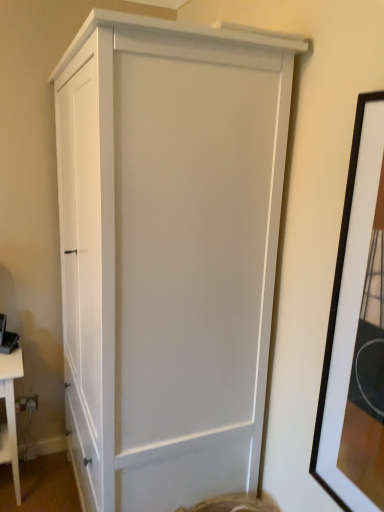
The width and height of the screenshot is (384, 512). What do you see at coordinates (10, 414) in the screenshot? I see `white matte table at lower left` at bounding box center [10, 414].

Locate an element on the screen. white matte cabinet at center is located at coordinates (168, 252).

Where is `black matte picture frame at right`? black matte picture frame at right is located at coordinates (356, 331).

Does white matte table at lower left have a smaller size compared to black matte picture frame at right?

Actually, white matte table at lower left might be larger than black matte picture frame at right.

You are a GUI agent. You are given a task and a screenshot of the screen. Output one action in this format:
    pyautogui.click(x=<x>, y=<y>)
    Task: Click on the table on the left of black matte picture frame at right
    
    Given the screenshot: What is the action you would take?
    pyautogui.click(x=10, y=414)

From a real-world perspective, does white matte table at lower left sit lower than black matte picture frame at right?

Yes.

Choose the correct answer: Is white matte table at lower left inside black matte picture frame at right or outside it?

white matte table at lower left lies outside black matte picture frame at right.

Is black matte picture frame at right turned away from white matte cabinet at center?

black matte picture frame at right does not have its back to white matte cabinet at center.

Is black matte picture frame at right next to white matte cabinet at center?

No, black matte picture frame at right is not touching white matte cabinet at center.

Does black matte picture frame at right have a larger size compared to white matte cabinet at center?

No, black matte picture frame at right is not bigger than white matte cabinet at center.

From the image's perspective, is black matte picture frame at right located beneath white matte cabinet at center?

No, from the image's perspective, black matte picture frame at right is not below white matte cabinet at center.

Is white matte cabinet at center bigger than black matte picture frame at right?

Indeed, white matte cabinet at center has a larger size compared to black matte picture frame at right.

Relative to black matte picture frame at right, is white matte cabinet at center in front or behind?

Clearly, white matte cabinet at center is behind black matte picture frame at right.

Is white matte cabinet at center looking in the opposite direction of black matte picture frame at right?

That's not correct — white matte cabinet at center is not looking away from black matte picture frame at right.

Does white matte cabinet at center touch black matte picture frame at right?

white matte cabinet at center and black matte picture frame at right are clearly separated.

Is black matte picture frame at right thinner than white matte table at lower left?

Indeed, black matte picture frame at right has a lesser width compared to white matte table at lower left.

Is black matte picture frame at right taller than white matte table at lower left?

Yes, black matte picture frame at right is taller than white matte table at lower left.

From a real-world perspective, is black matte picture frame at right positioned under white matte table at lower left based on gravity?

Incorrect, from a real-world perspective, black matte picture frame at right is higher than white matte table at lower left.

Is black matte picture frame at right positioned with its back to white matte table at lower left?

No, black matte picture frame at right's orientation is not away from white matte table at lower left.

From the image's perspective, which is above, white matte cabinet at center or white matte table at lower left?

white matte cabinet at center, from the image's perspective.

Is white matte cabinet at center inside or outside of white matte table at lower left?

white matte cabinet at center is located beyond the bounds of white matte table at lower left.

Is white matte cabinet at center in front of or behind white matte table at lower left in the image?

white matte cabinet at center is positioned closer to the viewer than white matte table at lower left.

From the picture: Is white matte cabinet at center taller or shorter than white matte table at lower left?

Considering their sizes, white matte cabinet at center has more height than white matte table at lower left.

Locate an element on the screen. This screenshot has height=512, width=384. cupboard above the white matte table at lower left (from the image's perspective) is located at coordinates (168, 252).

Considering the relative positions of white matte table at lower left and white matte cabinet at center in the image provided, is white matte table at lower left to the left of white matte cabinet at center from the viewer's perspective?

Yes, white matte table at lower left is to the left of white matte cabinet at center.

Between white matte table at lower left and white matte cabinet at center, which one has smaller size?

white matte table at lower left is smaller.

From the image's perspective, between white matte table at lower left and white matte cabinet at center, which one is located above?

From the image's view, white matte cabinet at center is above.

At what (x,y) coordinates should I click in order to perform the action: click on picture frame in front of the white matte table at lower left. Please return your answer as a coordinate pair (x, y). The width and height of the screenshot is (384, 512). Looking at the image, I should click on (356, 331).

This screenshot has height=512, width=384. I want to click on picture frame on the right of white matte cabinet at center, so click(x=356, y=331).

Considering their positions, is white matte table at lower left positioned closer to black matte picture frame at right than white matte cabinet at center?

white matte cabinet at center.

From the image, which object appears to be farther from white matte cabinet at center, black matte picture frame at right or white matte table at lower left?

white matte table at lower left is positioned further to the anchor white matte cabinet at center.

Consider the image. Based on their spatial positions, is white matte table at lower left or black matte picture frame at right further from white matte cabinet at center?

Among the two, white matte table at lower left is located further to white matte cabinet at center.

In the scene shown: Looking at the image, which one is located further to black matte picture frame at right, white matte cabinet at center or white matte table at lower left?

Among the two, white matte table at lower left is located further to black matte picture frame at right.

Considering their positions, is black matte picture frame at right positioned closer to white matte table at lower left than white matte cabinet at center?

Among the two, white matte cabinet at center is located nearer to white matte table at lower left.

Which object lies nearer to the anchor point white matte table at lower left, white matte cabinet at center or black matte picture frame at right?

Based on the image, white matte cabinet at center appears to be nearer to white matte table at lower left.

Locate an element on the screen. cupboard situated between white matte table at lower left and black matte picture frame at right from left to right is located at coordinates (168, 252).